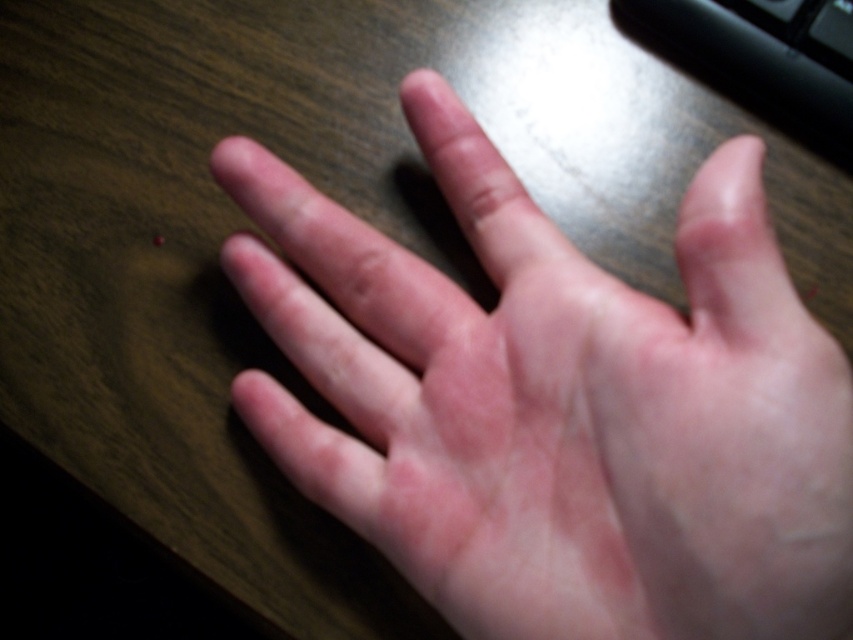
You are a photographer setting up a shoot. You need to position a light source so that it illuminates the pale skin hand at center without casting a shadow on the black plastic keyboard at upper right. Where should you place the light relative to the hand and keyboard?

The pale skin hand at center is in front of the black plastic keyboard at upper right. To avoid casting a shadow on the keyboard, the light should be placed directly above the hand, ensuring the shadow falls behind it away from the keyboard.

You are a robotic arm trying to place a small object on the wooden surface in the image. The robotic arm can only move to coordinates between 0.5 and 0.7 on the x and y axes. Is the pale skin hand at center within this area?

The pale skin hand at center is located at coordinates point (558, 404), which falls within the robotic arm movement range of 0.5 to 0.7 on both axes. Therefore, the robotic arm can place the object near the pale skin hand at center.

You are setting up a desk for a new computer. You have a pale skin hand at center and a black plastic keyboard at upper right. Which object is wider?

The pale skin hand at center is wider than the black plastic keyboard at upper right.